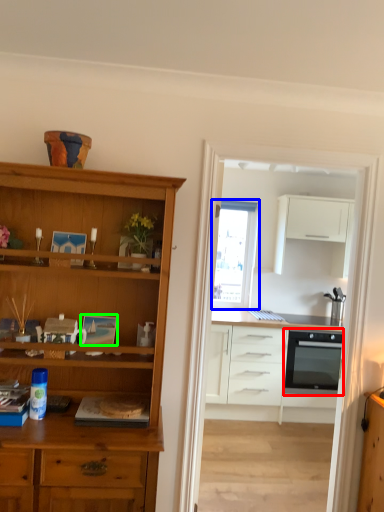
Question: Estimate the real-world distances between objects in this image. Which object is closer to oven (highlighted by a red box), window (highlighted by a blue box) or picture frame (highlighted by a green box)?

Choices:
 (A) window
 (B) picture frame

Answer: (A)